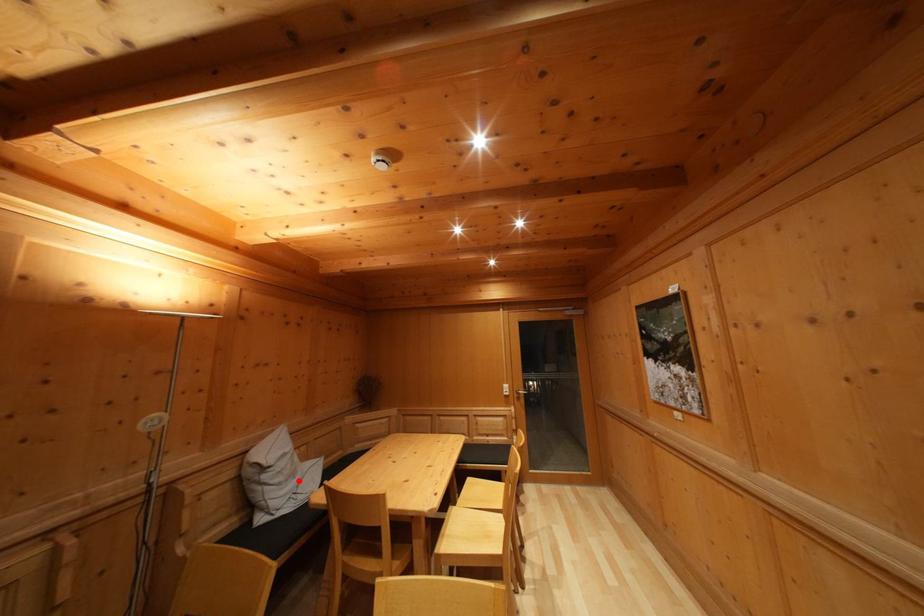
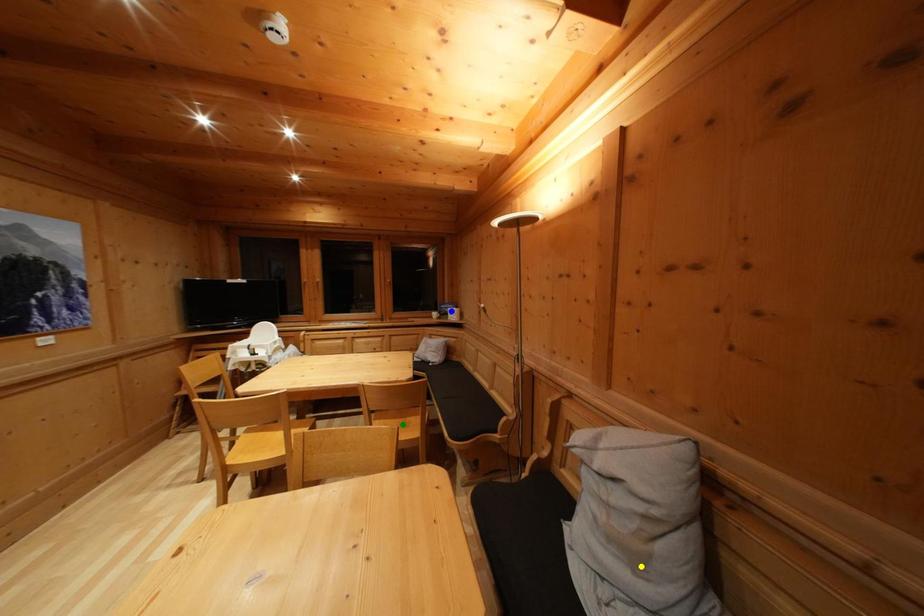
Question: I am providing you with two images of the same scene from different viewpoints. A red point is marked on the first image. You are given multiple points on the second image. In image 2, which mark is for the same physical point as the one in image 1?

Choices:
 (A) blue point
 (B) yellow point
 (C) green point

Answer: (B)